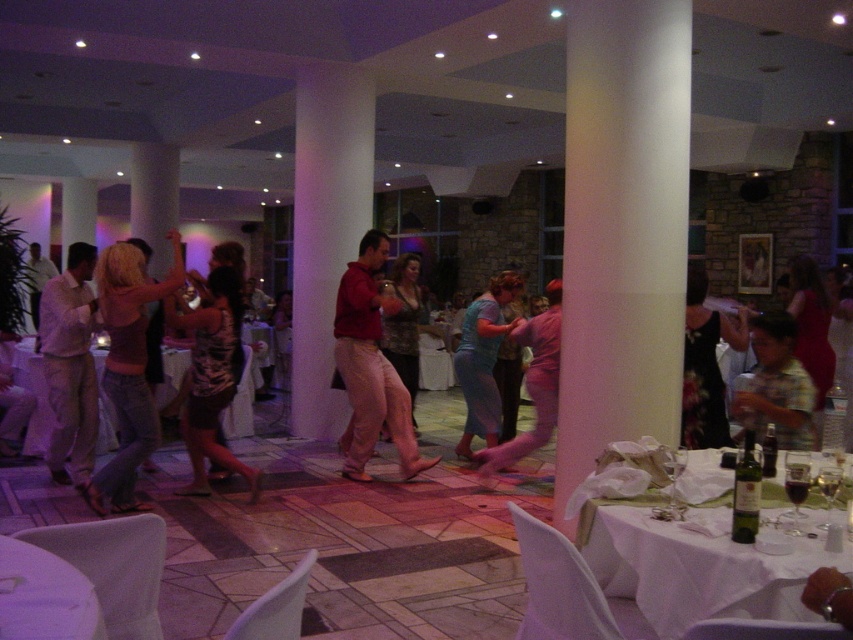
Question: From the image, what is the correct spatial relationship of blue satin dress at center in relation to transparent glass wine glass at lower right?

Choices:
 (A) above
 (B) below

Answer: (A)

Question: Is white glossy table at lower left bigger than pink fabric dress at center?

Choices:
 (A) no
 (B) yes

Answer: (A)

Question: Among these objects, which one is farthest from the camera?

Choices:
 (A) matte red dress at center
 (B) light brown cotton pants at left

Answer: (B)

Question: Does white cloth table at lower right lie in front of light brown cotton pants at left?

Choices:
 (A) no
 (B) yes

Answer: (B)

Question: Which of these objects is positioned farthest from the white tablecloth at center?

Choices:
 (A) white glossy table at lower left
 (B) denim jeans at center
 (C) matte red dress at center

Answer: (C)

Question: Which object is closer to the camera taking this photo?

Choices:
 (A) transparent glass wine glass at lower right
 (B) blue satin dress at center
 (C) white glossy table at lower left

Answer: (C)